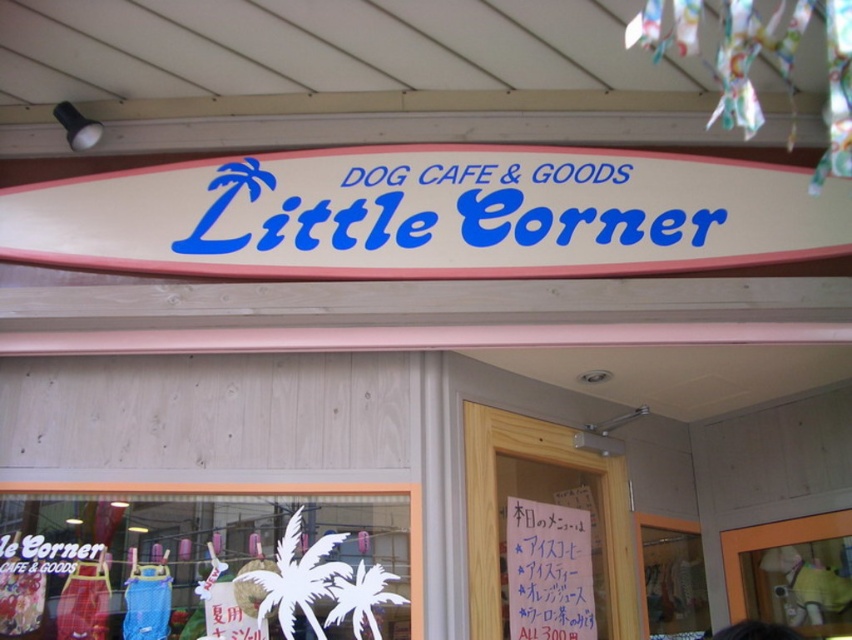
Question: Can you confirm if white matte surfboard at center is positioned to the right of white paper at center?

Choices:
 (A) yes
 (B) no

Answer: (B)

Question: Which object is farther from the camera taking this photo?

Choices:
 (A) white matte surfboard at center
 (B) white paper at center

Answer: (B)

Question: Is white matte surfboard at center positioned behind white paper at center?

Choices:
 (A) yes
 (B) no

Answer: (B)

Question: Which of the following is the farthest from the observer?

Choices:
 (A) white paper at center
 (B) white matte surfboard at center

Answer: (A)

Question: Can you confirm if white matte surfboard at center is positioned below white paper at center?

Choices:
 (A) yes
 (B) no

Answer: (B)